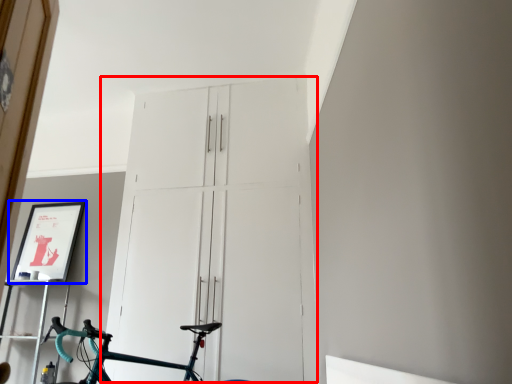
Question: Which point is closer to the camera, door (highlighted by a red box) or picture frame (highlighted by a blue box)?

Choices:
 (A) door
 (B) picture frame

Answer: (A)